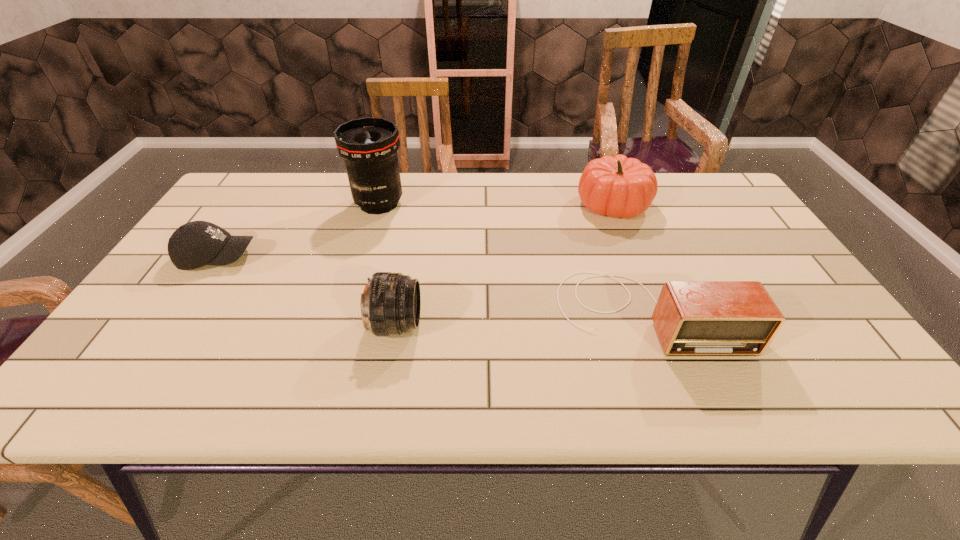
Where is `the taller telephoto lens`? the taller telephoto lens is located at coordinates (369, 145).

At what (x,y) coordinates should I click in order to perform the action: click on the tallest object. Please return your answer as a coordinate pair (x, y). Looking at the image, I should click on (369, 145).

Locate an element on the screen. pumpkin is located at coordinates (618, 186).

The width and height of the screenshot is (960, 540). Find the location of `the nearer telephoto lens`. the nearer telephoto lens is located at coordinates pyautogui.click(x=390, y=304).

Identify the location of radio receiver. The height and width of the screenshot is (540, 960). (692, 318).

Where is `the shortest object`? The height and width of the screenshot is (540, 960). the shortest object is located at coordinates (195, 244).

Where is `baseball cap`? This screenshot has height=540, width=960. baseball cap is located at coordinates (195, 244).

Identify the location of vacant point located 0.400m on the left of the tallest object. The width and height of the screenshot is (960, 540). (220, 204).

At what (x,y) coordinates should I click in order to perform the action: click on free space located on the right of the pumpkin. Please return your answer as a coordinate pair (x, y). The image size is (960, 540). Looking at the image, I should click on (739, 205).

What are the coordinates of `blank area located 0.240m at the front element of the nearer telephoto lens` in the screenshot? It's located at [x=527, y=325].